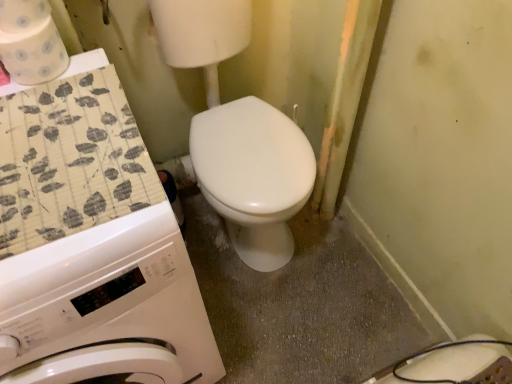
Question: Does patterned paper towel at upper left, which is the second toilet paper in top-to-bottom order, appear on the left side of white paper towel at upper left, the 2th toilet paper in the bottom-to-top sequence?

Choices:
 (A) no
 (B) yes

Answer: (A)

Question: Is patterned paper towel at upper left, acting as the first toilet paper starting from the bottom, placed right next to white paper towel at upper left, the 2th toilet paper in the bottom-to-top sequence?

Choices:
 (A) yes
 (B) no

Answer: (A)

Question: From the image's perspective, is patterned paper towel at upper left, acting as the first toilet paper starting from the bottom, on top of white paper towel at upper left, placed as the 1th toilet paper when sorted from top to bottom?

Choices:
 (A) yes
 (B) no

Answer: (B)

Question: Considering the relative positions of patterned paper towel at upper left, acting as the first toilet paper starting from the bottom, and white paper towel at upper left, the 2th toilet paper in the bottom-to-top sequence, in the image provided, is patterned paper towel at upper left, acting as the first toilet paper starting from the bottom, to the right of white paper towel at upper left, the 2th toilet paper in the bottom-to-top sequence, from the viewer's perspective?

Choices:
 (A) yes
 (B) no

Answer: (A)

Question: Considering the relative sizes of patterned paper towel at upper left, acting as the first toilet paper starting from the bottom, and white paper towel at upper left, placed as the 1th toilet paper when sorted from top to bottom, in the image provided, is patterned paper towel at upper left, acting as the first toilet paper starting from the bottom, shorter than white paper towel at upper left, placed as the 1th toilet paper when sorted from top to bottom,?

Choices:
 (A) yes
 (B) no

Answer: (B)

Question: Would you say patterned paper towel at upper left, which is the second toilet paper in top-to-bottom order, is outside white paper towel at upper left, the 2th toilet paper in the bottom-to-top sequence?

Choices:
 (A) no
 (B) yes

Answer: (B)

Question: Is white paper towel at upper left, the 2th toilet paper in the bottom-to-top sequence, at the left side of patterned paper towel at upper left, acting as the first toilet paper starting from the bottom?

Choices:
 (A) no
 (B) yes

Answer: (B)

Question: From a real-world perspective, is white paper towel at upper left, placed as the 1th toilet paper when sorted from top to bottom, located beneath patterned paper towel at upper left, which is the second toilet paper in top-to-bottom order?

Choices:
 (A) no
 (B) yes

Answer: (A)

Question: Is white paper towel at upper left, placed as the 1th toilet paper when sorted from top to bottom, bigger than patterned paper towel at upper left, acting as the first toilet paper starting from the bottom?

Choices:
 (A) no
 (B) yes

Answer: (A)

Question: Does white paper towel at upper left, placed as the 1th toilet paper when sorted from top to bottom, lie behind patterned paper towel at upper left, which is the second toilet paper in top-to-bottom order?

Choices:
 (A) yes
 (B) no

Answer: (B)

Question: Can you confirm if white paper towel at upper left, placed as the 1th toilet paper when sorted from top to bottom, is thinner than patterned paper towel at upper left, acting as the first toilet paper starting from the bottom?

Choices:
 (A) yes
 (B) no

Answer: (A)

Question: Is white paper towel at upper left, placed as the 1th toilet paper when sorted from top to bottom, facing away from patterned paper towel at upper left, acting as the first toilet paper starting from the bottom?

Choices:
 (A) yes
 (B) no

Answer: (B)

Question: Is white paper towel at upper left, placed as the 1th toilet paper when sorted from top to bottom, smaller than white glossy washing machine at left?

Choices:
 (A) yes
 (B) no

Answer: (A)